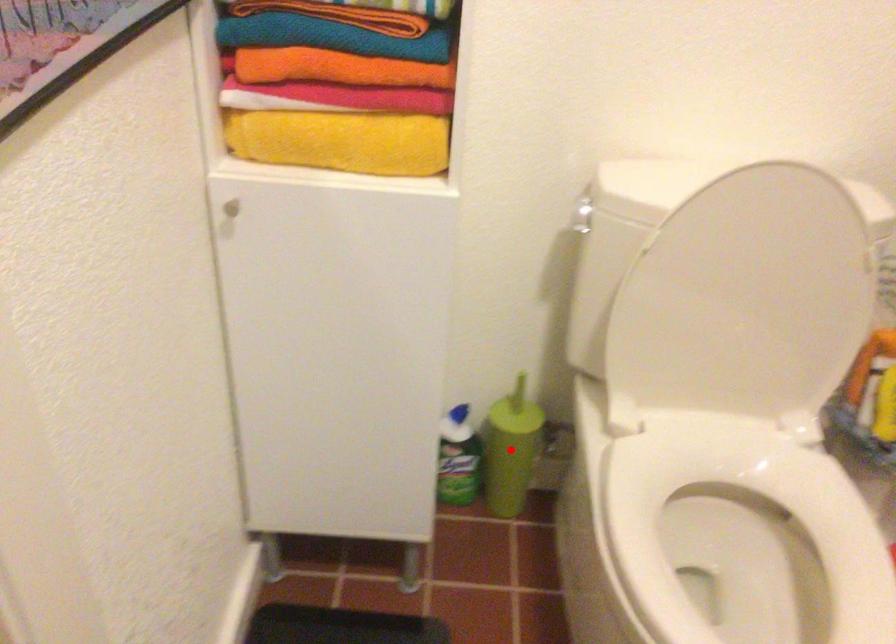
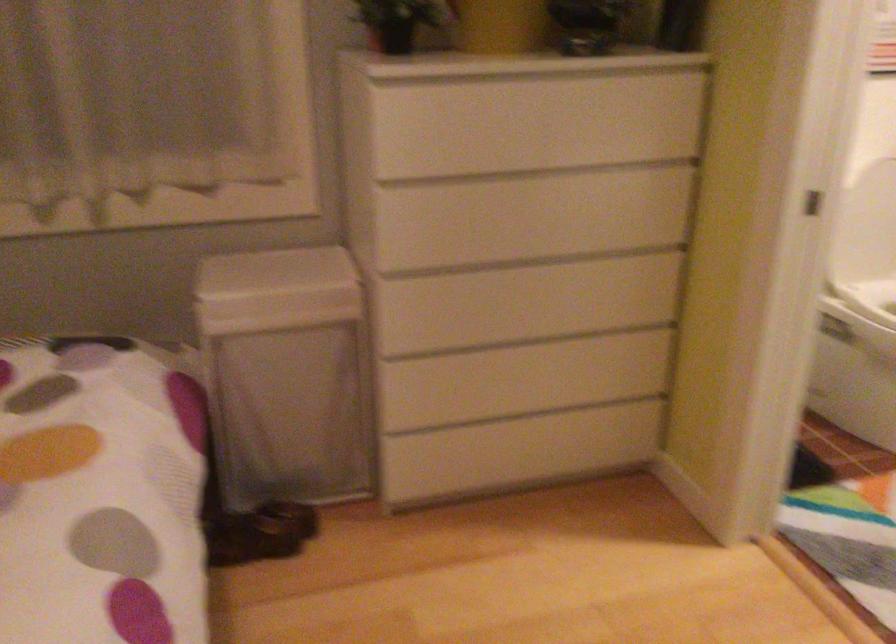
Question: I am providing you with two images of the same scene from different viewpoints. A red point is marked on the first image. Is the red point's position out of view in image 2?

Choices:
 (A) Yes
 (B) No

Answer: (A)